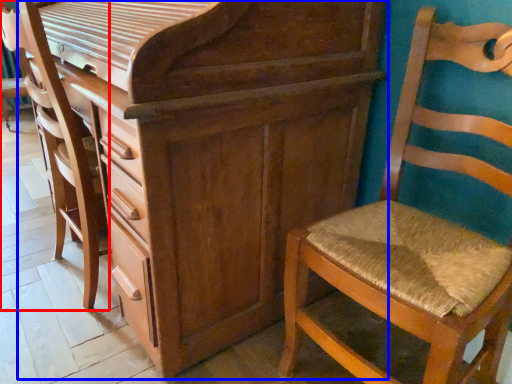
Question: Which of the following is the farthest to the observer, swivel chair (highlighted by a red box) or chest of drawers (highlighted by a blue box)?

Choices:
 (A) swivel chair
 (B) chest of drawers

Answer: (A)